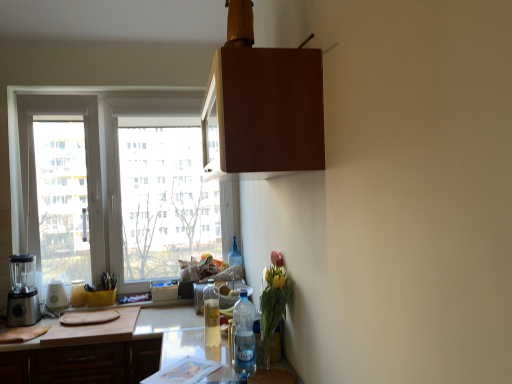
At what (x,y) coordinates should I click in order to perform the action: click on vacant space underneath satin silver blender at left, positioned as the 1th appliance in left-to-right order (from a real-world perspective). Please return your answer as a coordinate pair (x, y). Looking at the image, I should click on (21, 323).